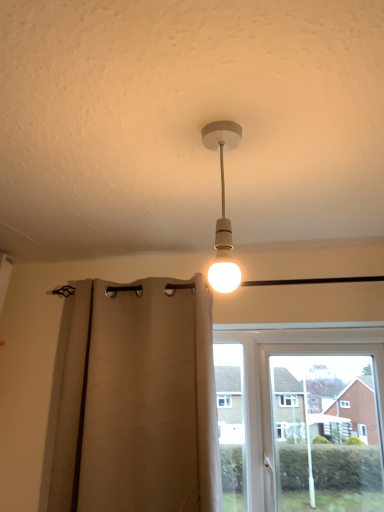
Question: Considering their positions, is white plastic window at center located in front of or behind white matte bulb at center?

Choices:
 (A) front
 (B) behind

Answer: (B)

Question: From a real-world perspective, is white plastic window at center above or below white matte bulb at center?

Choices:
 (A) below
 (B) above

Answer: (A)

Question: Which is farther from the white matte bulb at center?

Choices:
 (A) beige fabric curtain at center
 (B) white plastic window at center

Answer: (B)

Question: Considering the real-world distances, which object is closest to the white matte bulb at center?

Choices:
 (A) beige fabric curtain at center
 (B) white plastic window at center

Answer: (A)